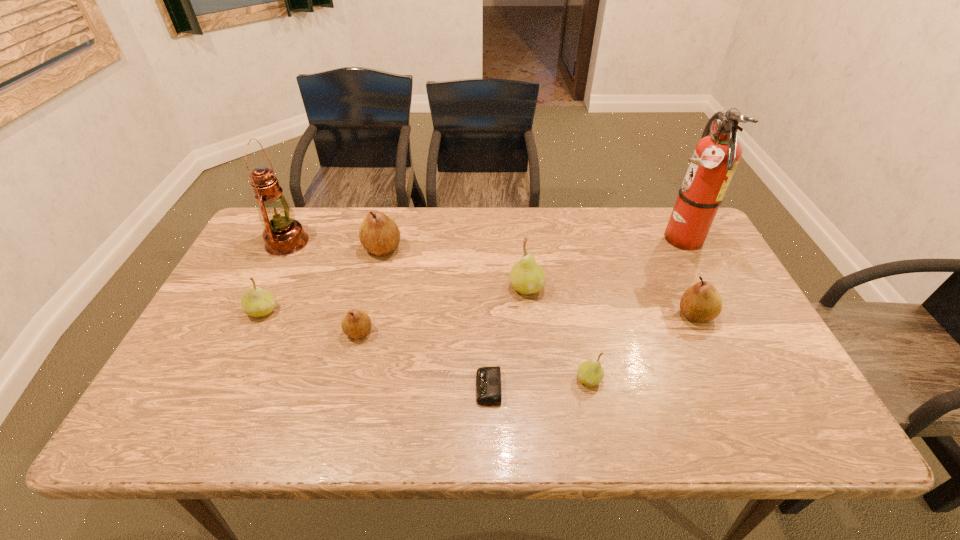
Locate an element on the screen. Image resolution: width=960 pixels, height=540 pixels. the rightmost pear is located at coordinates (700, 303).

At what (x,y) coordinates should I click in order to perform the action: click on the smallest brown pear. Please return your answer as a coordinate pair (x, y). This screenshot has height=540, width=960. Looking at the image, I should click on (355, 323).

Where is `the smallest green pear`? the smallest green pear is located at coordinates (590, 373).

Image resolution: width=960 pixels, height=540 pixels. What are the coordinates of `the nearest green pear` in the screenshot? It's located at (590, 373).

Identify the location of the shortest object. This screenshot has height=540, width=960. point(488,379).

Locate an element on the screen. Image resolution: width=960 pixels, height=540 pixels. alarm clock is located at coordinates (488, 379).

Find the location of `free space located from the nozzle of the fire extinguisher`. free space located from the nozzle of the fire extinguisher is located at coordinates (580, 239).

In order to click on vacant area located from the nozzle of the fire extinguisher in this screenshot , I will do `click(624, 239)`.

Locate an element on the screen. blank area located from the nozzle of the fire extinguisher is located at coordinates (602, 239).

You are a GUI agent. You are given a task and a screenshot of the screen. Output one action in this format:
    pyautogui.click(x=<x>, y=<y>)
    Task: Click on the free spot located on the right of the oil lamp
    The width and height of the screenshot is (960, 540).
    Given the screenshot: What is the action you would take?
    pyautogui.click(x=362, y=242)